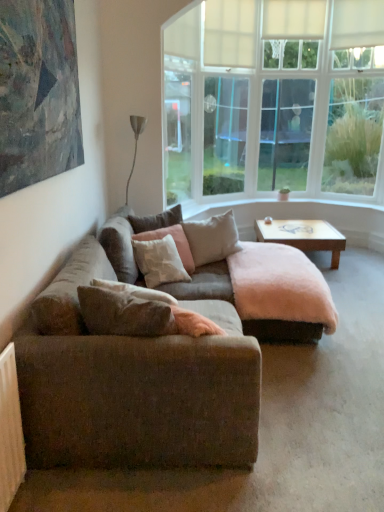
Question: Would you say soft pink fabric pillow at center, which is the 4th pillow from front to back, contains textured canvas painting at upper left?

Choices:
 (A) yes
 (B) no

Answer: (B)

Question: Does soft pink fabric pillow at center, which is the 4th pillow from front to back, have a lesser width compared to textured canvas painting at upper left?

Choices:
 (A) yes
 (B) no

Answer: (B)

Question: Considering the relative positions of soft pink fabric pillow at center, marked as the first pillow in a back-to-front arrangement, and textured canvas painting at upper left in the image provided, is soft pink fabric pillow at center, marked as the first pillow in a back-to-front arrangement, to the right of textured canvas painting at upper left from the viewer's perspective?

Choices:
 (A) yes
 (B) no

Answer: (A)

Question: Is soft pink fabric pillow at center, which is the 4th pillow from front to back, at the left side of textured canvas painting at upper left?

Choices:
 (A) yes
 (B) no

Answer: (B)

Question: From the image's perspective, would you say soft pink fabric pillow at center, which is the 4th pillow from front to back, is positioned over textured canvas painting at upper left?

Choices:
 (A) no
 (B) yes

Answer: (A)

Question: Does soft pink fabric pillow at center, marked as the first pillow in a back-to-front arrangement, have a greater width compared to textured canvas painting at upper left?

Choices:
 (A) no
 (B) yes

Answer: (B)

Question: Considering the relative sizes of wooden at center and beige fabric pillow at center, which appears as the 3th pillow when viewed from the front, in the image provided, is wooden at center bigger than beige fabric pillow at center, which appears as the 3th pillow when viewed from the front,?

Choices:
 (A) no
 (B) yes

Answer: (B)

Question: From the image's perspective, is wooden at center beneath beige fabric pillow at center, which appears as the 3th pillow when viewed from the front?

Choices:
 (A) yes
 (B) no

Answer: (A)

Question: Is wooden at center not within beige fabric pillow at center, which is the second pillow from back to front?

Choices:
 (A) yes
 (B) no

Answer: (A)

Question: Is wooden at center further to camera compared to beige fabric pillow at center, which appears as the 3th pillow when viewed from the front?

Choices:
 (A) yes
 (B) no

Answer: (A)

Question: Does wooden at center appear on the left side of beige fabric pillow at center, which is the second pillow from back to front?

Choices:
 (A) yes
 (B) no

Answer: (B)

Question: Are wooden at center and beige fabric pillow at center, which is the second pillow from back to front, making contact?

Choices:
 (A) no
 (B) yes

Answer: (A)

Question: Is wooden at center positioned with its back to white soft pillow at center, the third pillow viewed from the back?

Choices:
 (A) no
 (B) yes

Answer: (A)